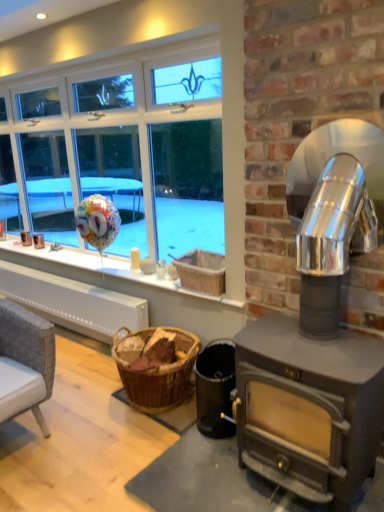
The image size is (384, 512). Describe the element at coordinates (202, 271) in the screenshot. I see `wooden basket at center` at that location.

The image size is (384, 512). I want to click on black matte wood stove at lower right, so click(x=215, y=388).

What do you see at coordinates (298, 117) in the screenshot?
I see `metallic silver fireplace at right` at bounding box center [298, 117].

Identify the location of wooden basket at center. This screenshot has width=384, height=512. (202, 271).

Is black matte wood stove at lower right inside the boundaries of metallic silver fireplace at right, or outside?

The correct answer is: outside.

Between black matte wood stove at lower right and metallic silver fireplace at right, which one has less height?

black matte wood stove at lower right.

How many degrees apart are the facing directions of black matte wood stove at lower right and metallic silver fireplace at right?

1.19 degrees separate the facing orientations of black matte wood stove at lower right and metallic silver fireplace at right.

Considering the relative positions of black matte wood stove at lower right and metallic silver fireplace at right in the image provided, is black matte wood stove at lower right in front of metallic silver fireplace at right?

No, black matte wood stove at lower right is behind metallic silver fireplace at right.

Could you tell me if wooden basket at center is turned towards metallic silver fireplace at right?

No, wooden basket at center is not aimed at metallic silver fireplace at right.

Considering the sizes of wooden basket at center and metallic silver fireplace at right in the image, is wooden basket at center taller or shorter than metallic silver fireplace at right?

Considering their sizes, wooden basket at center has less height than metallic silver fireplace at right.

Which object is positioned more to the right, wooden basket at center or metallic silver fireplace at right?

metallic silver fireplace at right.

Consider the image. Who is more distant, wooden basket at center or metallic silver fireplace at right?

wooden basket at center is behind.

Which is farther, (205, 264) or (222, 370)?

The point (205, 264) is farther from the camera.

Is wooden basket at center positioned far away from black matte wood stove at lower right?

No, there isn't a large distance between wooden basket at center and black matte wood stove at lower right.

Which is behind, wooden basket at center or black matte wood stove at lower right?

wooden basket at center is behind.

In the scene shown: From a real-world perspective, is wooden basket at center located higher than black matte wood stove at lower right?

Correct, in the physical world, wooden basket at center is higher than black matte wood stove at lower right.

Considering the sizes of metallic silver fireplace at right and wooden basket at center in the image, is metallic silver fireplace at right taller or shorter than wooden basket at center?

metallic silver fireplace at right is taller than wooden basket at center.

Relative to wooden basket at center, is metallic silver fireplace at right in front or behind?

Visually, metallic silver fireplace at right is located in front of wooden basket at center.

Does metallic silver fireplace at right have a larger size compared to wooden basket at center?

Indeed, metallic silver fireplace at right has a larger size compared to wooden basket at center.

Between metallic silver fireplace at right and black matte wood stove at lower right, which one is positioned in front?

Positioned in front is metallic silver fireplace at right.

Which is nearer, [382,126] or [224,429]?

The point [382,126] is more forward.

Identify the location of appliance on the left side of metallic silver fireplace at right. coord(215,388).

Considering the sizes of objects black matte wood stove at lower right and wooden basket at center in the image provided, who is taller, black matte wood stove at lower right or wooden basket at center?

Standing taller between the two is black matte wood stove at lower right.

Can you confirm if black matte wood stove at lower right is bigger than wooden basket at center?

Indeed, black matte wood stove at lower right has a larger size compared to wooden basket at center.

Which is less distant, (222, 423) or (217, 269)?

Point (222, 423) is positioned closer to the camera compared to point (217, 269).

Identify the location of fireplace in front of the black matte wood stove at lower right. (298, 117).

Image resolution: width=384 pixels, height=512 pixels. Identify the location of fireplace on the right of wooden basket at center. pyautogui.click(x=298, y=117).

Estimate the real-world distances between objects in this image. Which object is closer to wooden basket at center, black matte wood stove at lower right or metallic silver fireplace at right?

Among the two, black matte wood stove at lower right is located nearer to wooden basket at center.

Estimate the real-world distances between objects in this image. Which object is further from black matte wood stove at lower right, metallic silver fireplace at right or wooden basket at center?

metallic silver fireplace at right is further to black matte wood stove at lower right.

Looking at the image, which one is located closer to metallic silver fireplace at right, wooden basket at center or black matte wood stove at lower right?

wooden basket at center is closer to metallic silver fireplace at right.

From the image, which object appears to be nearer to black matte wood stove at lower right, wooden basket at center or metallic silver fireplace at right?

Among the two, wooden basket at center is located nearer to black matte wood stove at lower right.

Considering their positions, is black matte wood stove at lower right positioned closer to metallic silver fireplace at right than wooden basket at center?

wooden basket at center lies closer to metallic silver fireplace at right than the other object.

Estimate the real-world distances between objects in this image. Which object is further from wooden basket at center, metallic silver fireplace at right or black matte wood stove at lower right?

metallic silver fireplace at right is positioned further to the anchor wooden basket at center.

This screenshot has height=512, width=384. I want to click on appliance located between metallic silver fireplace at right and wooden basket at center in the depth direction, so click(x=215, y=388).